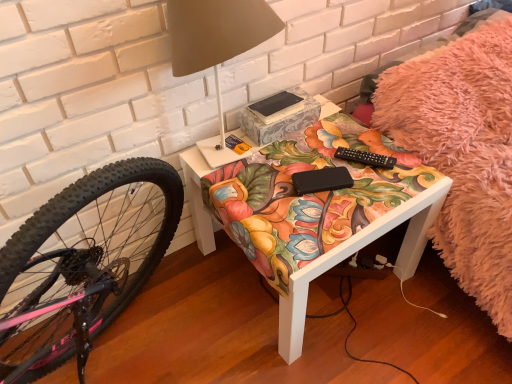
Question: From the image's perspective, would you say black matte book at center is shown under matte floral-patterned table at center?

Choices:
 (A) no
 (B) yes

Answer: (A)

Question: Is black matte book at center to the left of matte floral-patterned table at center from the viewer's perspective?

Choices:
 (A) no
 (B) yes

Answer: (B)

Question: Is black matte book at center to the right of matte floral-patterned table at center from the viewer's perspective?

Choices:
 (A) no
 (B) yes

Answer: (A)

Question: Considering the relative sizes of black matte book at center and matte floral-patterned table at center in the image provided, is black matte book at center wider than matte floral-patterned table at center?

Choices:
 (A) no
 (B) yes

Answer: (A)

Question: Are black matte book at center and matte floral-patterned table at center making contact?

Choices:
 (A) yes
 (B) no

Answer: (B)

Question: In the image, is matte floral-patterned table at center on the left side or the right side of matte white table lamp at upper center?

Choices:
 (A) right
 (B) left

Answer: (A)

Question: Relative to matte white table lamp at upper center, is matte floral-patterned table at center in front or behind?

Choices:
 (A) behind
 (B) front

Answer: (A)

Question: Considering the positions of point (391, 223) and point (178, 64), is point (391, 223) closer or farther from the camera than point (178, 64)?

Choices:
 (A) closer
 (B) farther

Answer: (B)

Question: From the image's perspective, is matte floral-patterned table at center above or below matte white table lamp at upper center?

Choices:
 (A) above
 (B) below

Answer: (B)

Question: Is matte floral-patterned table at center bigger or smaller than black matte book at center?

Choices:
 (A) big
 (B) small

Answer: (A)

Question: Considering the positions of matte floral-patterned table at center and black matte book at center in the image, is matte floral-patterned table at center taller or shorter than black matte book at center?

Choices:
 (A) tall
 (B) short

Answer: (A)

Question: Visually, is matte floral-patterned table at center positioned to the left or to the right of black matte book at center?

Choices:
 (A) left
 (B) right

Answer: (B)

Question: From a real-world perspective, is matte floral-patterned table at center above or below black matte book at center?

Choices:
 (A) above
 (B) below

Answer: (B)

Question: Relative to black matte book at center, is matte white table lamp at upper center in front or behind?

Choices:
 (A) front
 (B) behind

Answer: (A)

Question: Looking at the image, does matte white table lamp at upper center seem bigger or smaller compared to black matte book at center?

Choices:
 (A) small
 (B) big

Answer: (B)